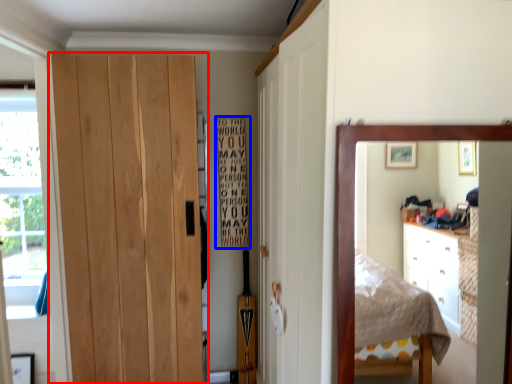
Question: Which object appears closest to the camera in this image, door (highlighted by a red box) or bulletin board (highlighted by a blue box)?

Choices:
 (A) door
 (B) bulletin board

Answer: (A)